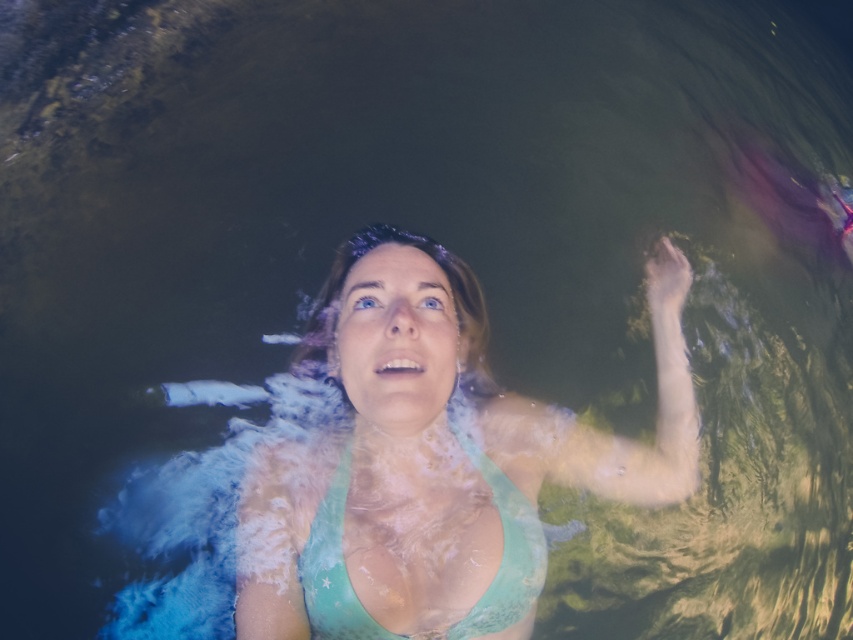
You are a photographer taking a picture of the person floating in water. You want to focus on both the point at point (474, 342) and the point at point (329, 486). Which point is closer to your camera lens?

Point (474, 342) is further to the viewer than point (329, 486), so the point at point (329, 486) is closer to the camera lens.

You are a lifeguard observing the scene from above. You notice a point marked at coordinates (434, 460). What object is located at that point?

The point at coordinates (434, 460) marks the teal lace bikini top at center.

Consider the image. You are a swimmer trying to decide whether to wear the teal lace bikini top at center or the teal fabric bikini top at center for a swim in the water shown. Considering the scene described, which bikini top might be more practical for swimming in this environment?

The teal fabric bikini top at center is more practical for swimming in this environment because it is made of fabric, which is less likely to be damaged by water and ripples compared to lace, which may fray or become loose in the water.